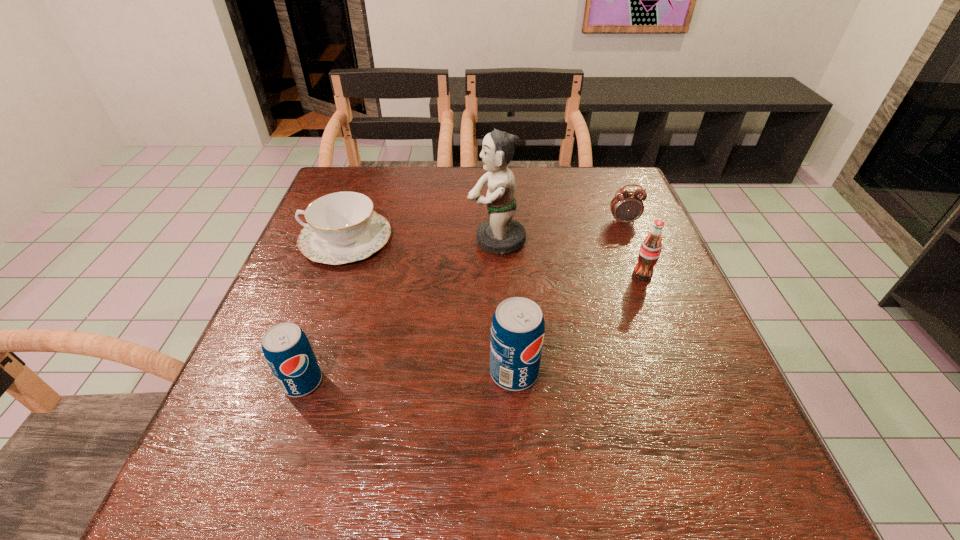
Locate an element on the screen. free space at the left edge of the desktop is located at coordinates (323, 303).

Where is `free space at the right edge`? This screenshot has width=960, height=540. free space at the right edge is located at coordinates (668, 329).

Where is `vacant space at the far left corner of the desktop`? This screenshot has width=960, height=540. vacant space at the far left corner of the desktop is located at coordinates (348, 177).

Locate an element on the screen. The width and height of the screenshot is (960, 540). free space at the near left corner is located at coordinates (265, 404).

The width and height of the screenshot is (960, 540). Find the location of `free space at the far right corner of the desktop`. free space at the far right corner of the desktop is located at coordinates (595, 202).

Where is `free space between the leftmost soda and the chinaware`? This screenshot has height=540, width=960. free space between the leftmost soda and the chinaware is located at coordinates [324, 310].

Locate an element on the screen. Image resolution: width=960 pixels, height=540 pixels. vacant region between the leftmost soda and the chinaware is located at coordinates (324, 310).

This screenshot has width=960, height=540. I want to click on vacant area that lies between the shortest object and the rightmost soda, so click(494, 257).

You are a GUI agent. You are given a task and a screenshot of the screen. Output one action in this format:
    pyautogui.click(x=<x>, y=<y>)
    Task: Click on the free space between the alarm clock and the tallest object
    
    Given the screenshot: What is the action you would take?
    pyautogui.click(x=560, y=231)

The width and height of the screenshot is (960, 540). I want to click on free space between the farthest soda and the chinaware, so click(x=494, y=257).